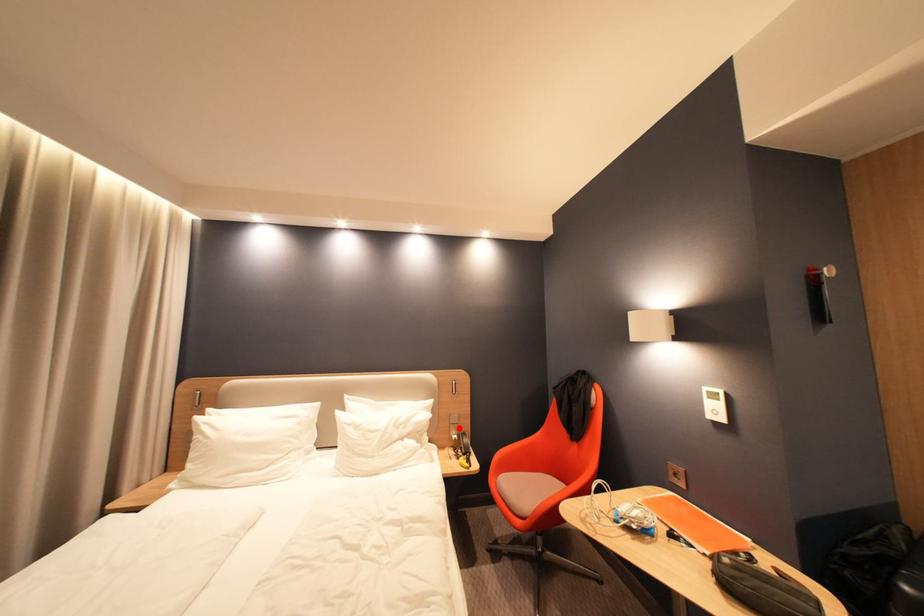
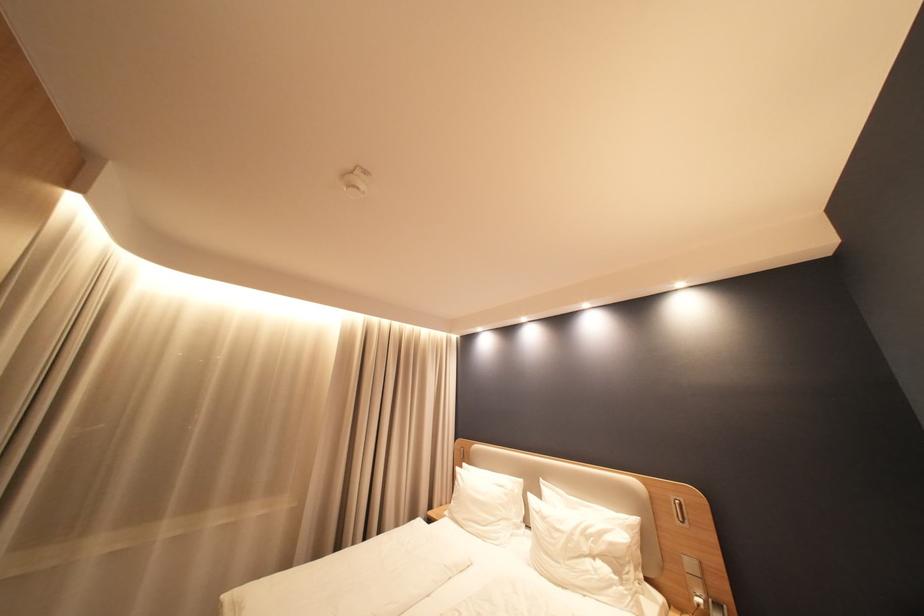
The point at the highlighted location is marked in the first image. Where is the corresponding point in the second image?

(696, 578)